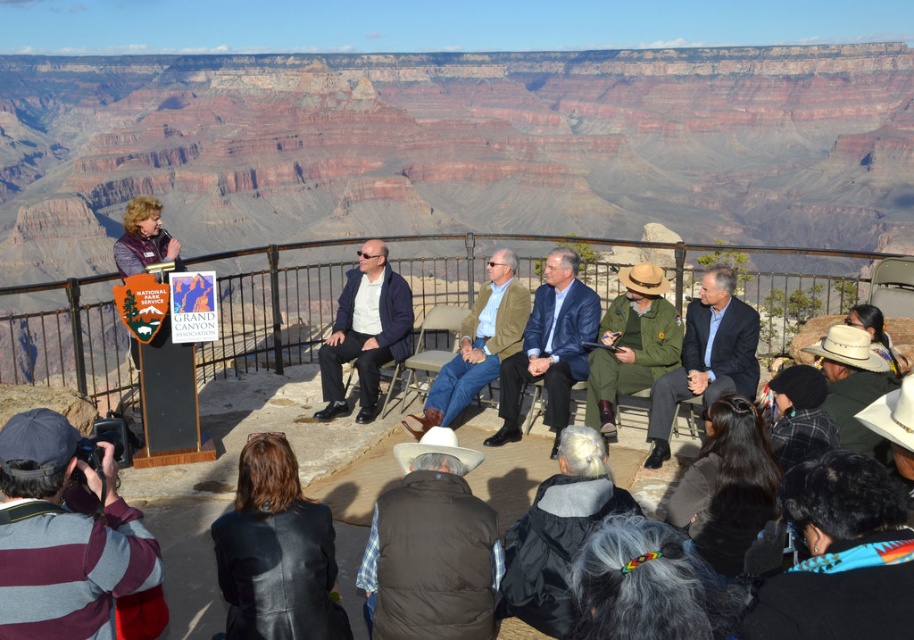
Which is in front, point (580, 355) or point (383, 307)?

Point (580, 355) is in front.

Is point (505, 384) closer to viewer compared to point (338, 376)?

Yes, it is.

What do you see at coordinates (549, 348) in the screenshot? I see `blue fabric suit at center` at bounding box center [549, 348].

Where is `blue fabric suit at center`? The width and height of the screenshot is (914, 640). blue fabric suit at center is located at coordinates (549, 348).

At what (x,y) coordinates should I click in order to perform the action: click on blue fabric suit at center. Please return your answer as a coordinate pair (x, y). Looking at the image, I should click on (549, 348).

Between point (547, 403) and point (509, 349), which one is positioned in front?

Point (547, 403) is more forward.

At what (x,y) coordinates should I click in order to perform the action: click on blue fabric suit at center. Please return your answer as a coordinate pair (x, y). Looking at the image, I should click on (549, 348).

Consider the image. Is brown puffy vest at lower center to the left of matte green uniform at center from the viewer's perspective?

Yes, brown puffy vest at lower center is to the left of matte green uniform at center.

Is brown puffy vest at lower center thinner than matte green uniform at center?

Yes.

Between point (412, 627) and point (705, 376), which one is positioned behind?

The point (705, 376) is behind.

You are a GUI agent. You are given a task and a screenshot of the screen. Output one action in this format:
    pyautogui.click(x=<x>, y=<y>)
    Task: Click on the brown puffy vest at lower center
    The image size is (914, 640).
    Given the screenshot: What is the action you would take?
    [432, 548]